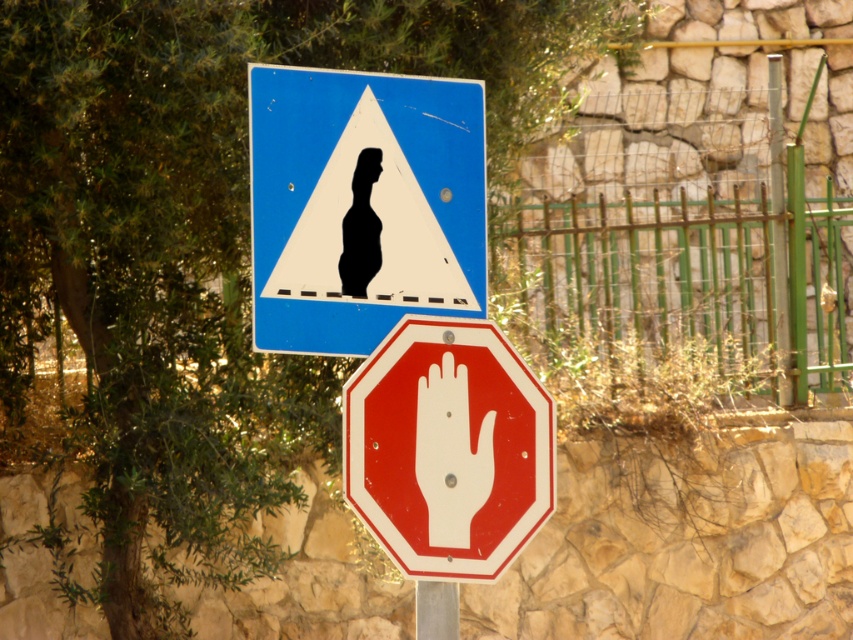
Is point (520, 212) behind point (425, 621)?

That is True.

Is green metal fence at center right above metallic pole at center?

Yes, green metal fence at center right is above metallic pole at center.

Is point (848, 300) positioned in front of point (430, 628)?

No, (848, 300) is further to viewer.

At what (x,y) coordinates should I click in order to perform the action: click on green metal fence at center right. Please return your answer as a coordinate pair (x, y). Looking at the image, I should click on (698, 275).

In the scene shown: Which of these two, blue glossy triangle at upper center or green metal fence at center right, stands taller?

Standing taller between the two is green metal fence at center right.

Who is positioned more to the left, blue glossy triangle at upper center or green metal fence at center right?

From the viewer's perspective, blue glossy triangle at upper center appears more on the left side.

The image size is (853, 640). I want to click on blue glossy triangle at upper center, so click(x=363, y=204).

In order to click on blue glossy triangle at upper center in this screenshot , I will do `click(363, 204)`.

In the scene shown: Is blue glossy triangle at upper center thinner than metallic pole at center?

In fact, blue glossy triangle at upper center might be wider than metallic pole at center.

You are a GUI agent. You are given a task and a screenshot of the screen. Output one action in this format:
    pyautogui.click(x=<x>, y=<y>)
    Task: Click on the blue glossy triangle at upper center
    
    Given the screenshot: What is the action you would take?
    pyautogui.click(x=363, y=204)

Locate an element on the screen. This screenshot has width=853, height=640. blue glossy triangle at upper center is located at coordinates (363, 204).